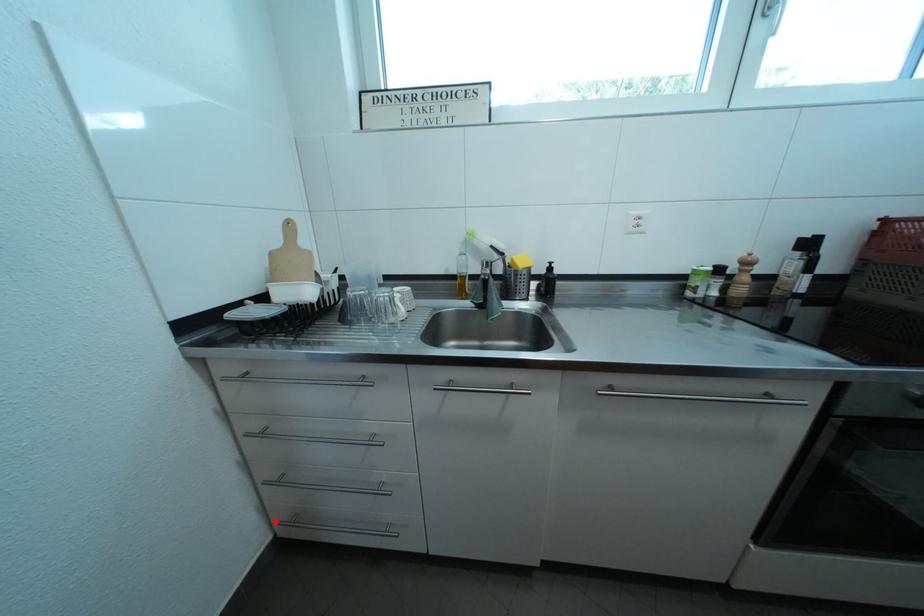
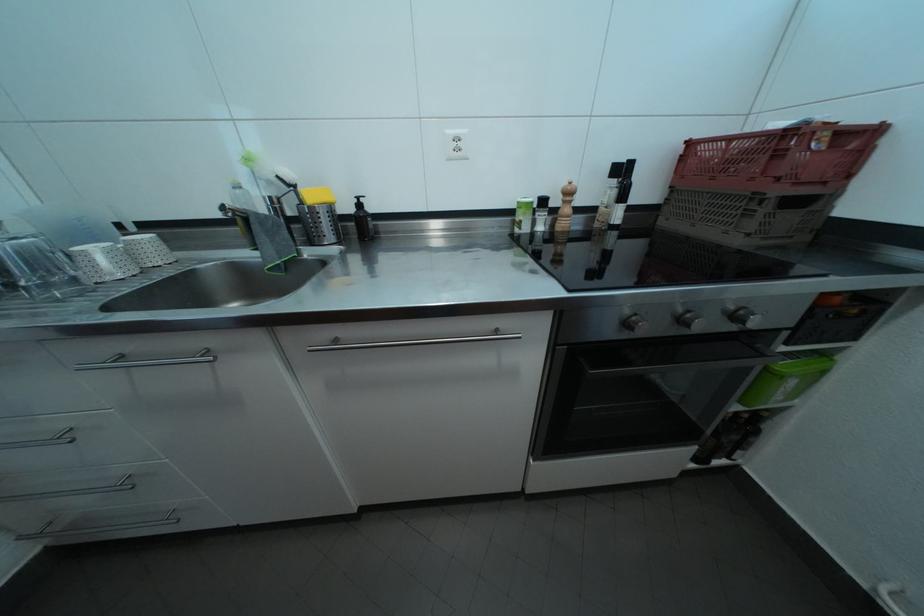
Question: I am providing you with two images of the same scene from different viewpoints. Image1 has a red point marked. In image2, the corresponding 3D location appears at what relative position? Reply with the corresponding letter.

Choices:
 (A) Closer
 (B) Farther

Answer: (A)